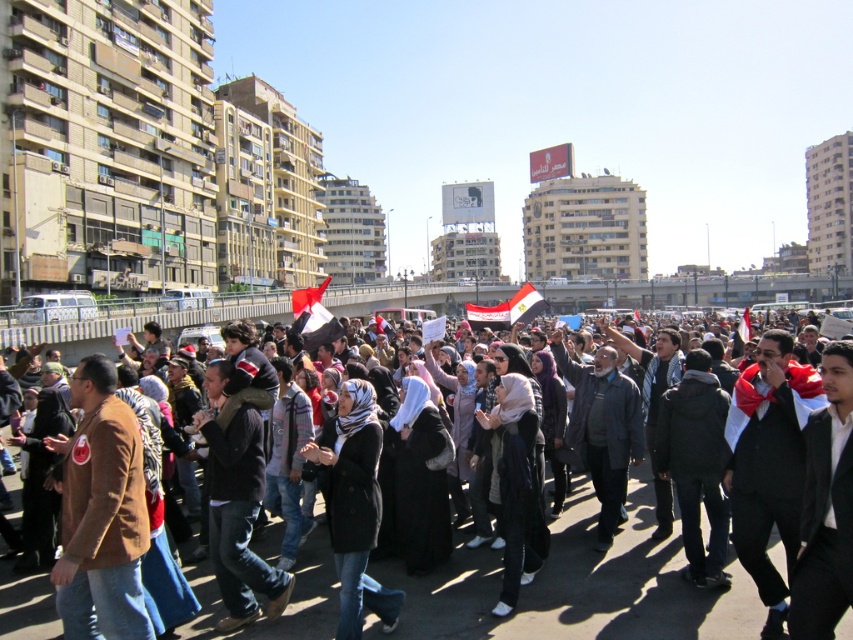
Question: Which point is closer to the camera taking this photo?

Choices:
 (A) (830, 476)
 (B) (662, 522)
 (C) (607, 490)

Answer: (A)

Question: Which is nearer to the dark brown leather jacket at center?

Choices:
 (A) white fabric scarf at center
 (B) dark gray jacket at center
 (C) black suit at center
 (D) dark gray coat at center

Answer: (D)

Question: Does white fabric scarf at center appear on the left side of dark gray coat at center?

Choices:
 (A) no
 (B) yes

Answer: (A)

Question: Which point is closer to the camera taking this photo?

Choices:
 (A) (148, 529)
 (B) (842, 429)

Answer: (B)

Question: From the image, what is the correct spatial relationship of black suit at center in relation to dark gray jacket at center?

Choices:
 (A) above
 (B) below

Answer: (B)

Question: Considering the relative positions of dark brown leather jacket at center and black suit at center in the image provided, where is dark brown leather jacket at center located with respect to black suit at center?

Choices:
 (A) above
 (B) below

Answer: (B)